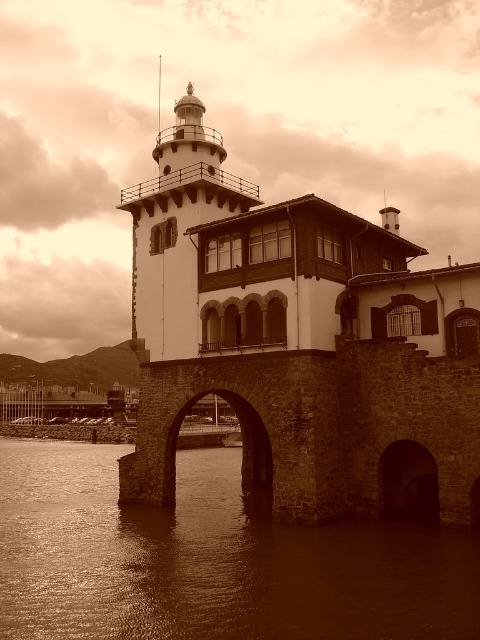
Question: Which of the following is the closest to the observer?

Choices:
 (A) white matte/lightweight tower at upper center
 (B) brown water at lower center

Answer: (B)

Question: Does brown water at lower center appear on the right side of white matte/lightweight tower at upper center?

Choices:
 (A) yes
 (B) no

Answer: (B)

Question: In this image, where is brown water at lower center located relative to white matte/lightweight tower at upper center?

Choices:
 (A) left
 (B) right

Answer: (A)

Question: Is brown water at lower center to the left of white matte/lightweight tower at upper center from the viewer's perspective?

Choices:
 (A) yes
 (B) no

Answer: (A)